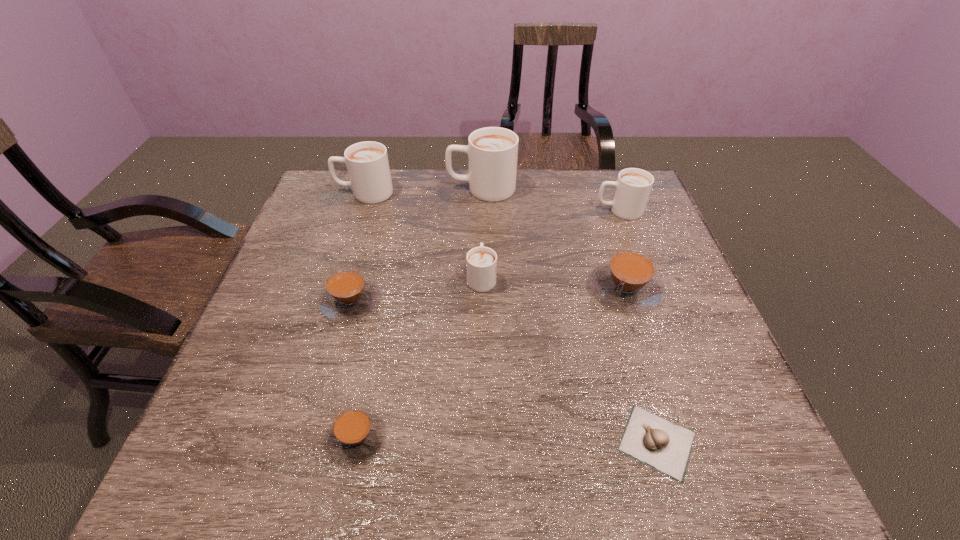
I want to click on the second closest white cappuccino to the rightmost brown cappuccino, so click(x=481, y=261).

Choose which brown cappuccino is the nearest neighbor to the sixth shortest cappuccino. Please provide its 2D coordinates. Your answer should be formatted as a tuple, i.e. [(x, y)], where the tuple contains the x and y coordinates of a point satisfying the conditions above.

[(348, 295)]

Locate which brown cappuccino ranks in proximity to the shortest object. Please provide its 2D coordinates. Your answer should be formatted as a tuple, i.e. [(x, y)], where the tuple contains the x and y coordinates of a point satisfying the conditions above.

[(628, 281)]

You are a GUI agent. You are given a task and a screenshot of the screen. Output one action in this format:
    pyautogui.click(x=<x>, y=<y>)
    Task: Click on the vacant space that satisfies the following two spatial constraints: 1. on the side with the handle of the nearest white cappuccino; 2. on the side with the handle of the tallest cappuccino
    This screenshot has width=960, height=540.
    Given the screenshot: What is the action you would take?
    pyautogui.click(x=481, y=188)

The width and height of the screenshot is (960, 540). What are the coordinates of `free space that satisfies the following two spatial constraints: 1. on the side with the handle of the tallest cappuccino; 2. on the side with the handle of the smallest white cappuccino` in the screenshot? It's located at (482, 277).

Where is `free space that satisfies the following two spatial constraints: 1. on the side with the handle of the second biggest white cappuccino; 2. on the right side of the shortest cappuccino`? The height and width of the screenshot is (540, 960). free space that satisfies the following two spatial constraints: 1. on the side with the handle of the second biggest white cappuccino; 2. on the right side of the shortest cappuccino is located at coordinates (285, 437).

Image resolution: width=960 pixels, height=540 pixels. What are the coordinates of `free location that satisfies the following two spatial constraints: 1. on the side with the handle of the sixth shortest cappuccino; 2. on the side with the handle of the smallest white cappuccino` in the screenshot? It's located at (337, 277).

Locate an element on the screen. The image size is (960, 540). free location that satisfies the following two spatial constraints: 1. on the side with the handle of the leftmost white cappuccino; 2. on the back side of the nearest cappuccino is located at coordinates (285, 437).